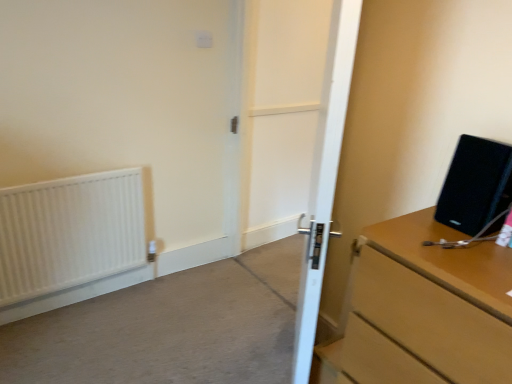
Question: Does white matte radiator at left lie behind white wooden door at center?

Choices:
 (A) no
 (B) yes

Answer: (B)

Question: Can you confirm if white matte radiator at left is thinner than white wooden door at center?

Choices:
 (A) yes
 (B) no

Answer: (A)

Question: Can you confirm if white matte radiator at left is smaller than white wooden door at center?

Choices:
 (A) yes
 (B) no

Answer: (A)

Question: Is white matte radiator at left not within white wooden door at center?

Choices:
 (A) yes
 (B) no

Answer: (A)

Question: Can you confirm if white matte radiator at left is shorter than white wooden door at center?

Choices:
 (A) yes
 (B) no

Answer: (A)

Question: Is white wooden door at center inside white matte radiator at left?

Choices:
 (A) yes
 (B) no

Answer: (B)

Question: Considering the relative sizes of wooden chest of drawers at right and white wooden door at center in the image provided, is wooden chest of drawers at right smaller than white wooden door at center?

Choices:
 (A) yes
 (B) no

Answer: (B)

Question: Is wooden chest of drawers at right taller than white wooden door at center?

Choices:
 (A) yes
 (B) no

Answer: (B)

Question: Can you confirm if wooden chest of drawers at right is wider than white wooden door at center?

Choices:
 (A) yes
 (B) no

Answer: (A)

Question: From a real-world perspective, is wooden chest of drawers at right on white wooden door at center?

Choices:
 (A) no
 (B) yes

Answer: (A)

Question: Are wooden chest of drawers at right and white wooden door at center located far from each other?

Choices:
 (A) yes
 (B) no

Answer: (A)

Question: Is wooden chest of drawers at right to the right of white wooden door at center from the viewer's perspective?

Choices:
 (A) no
 (B) yes

Answer: (B)

Question: Considering the relative sizes of white matte radiator at left and white wooden door at center in the image provided, is white matte radiator at left shorter than white wooden door at center?

Choices:
 (A) no
 (B) yes

Answer: (B)